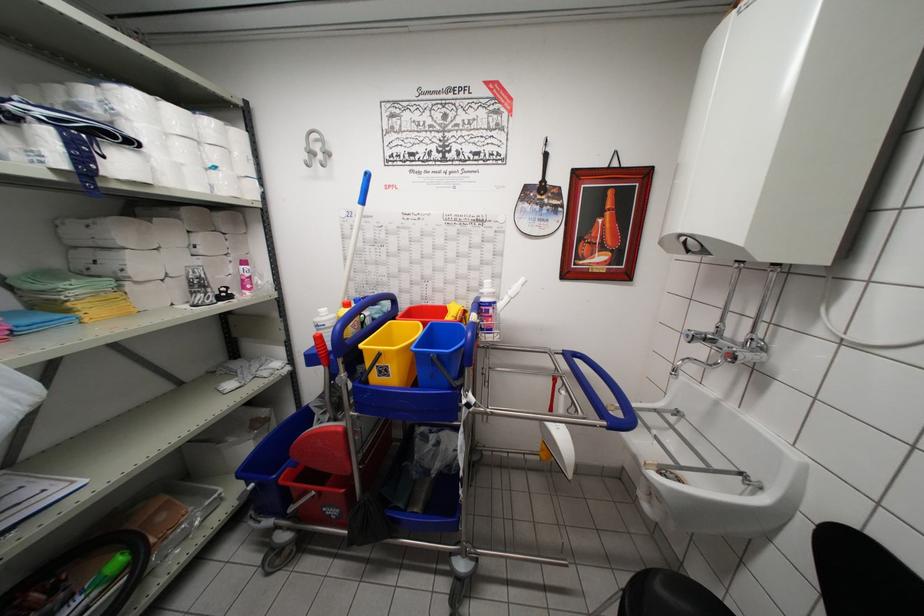
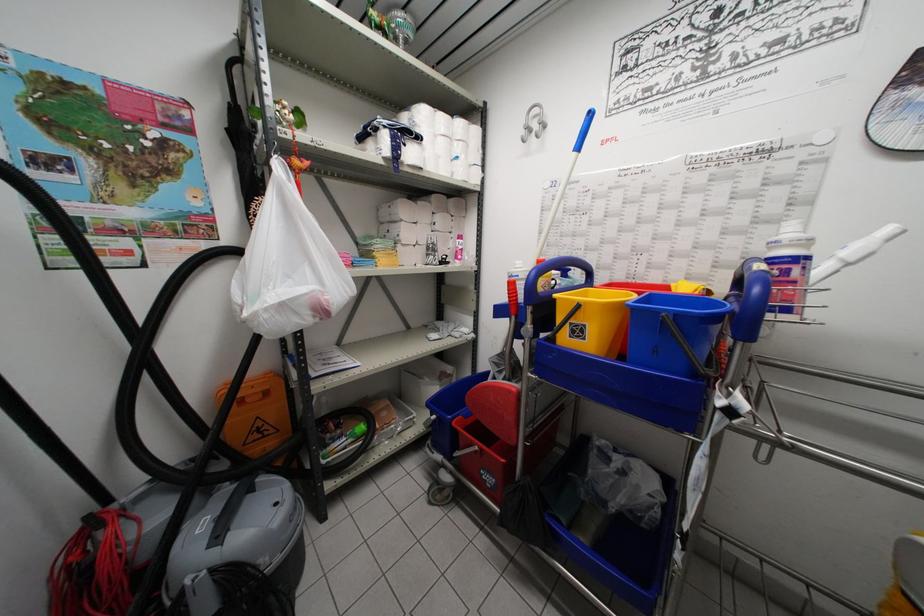
Question: The first image is from the beginning of the video and the second image is from the end. How did the camera likely rotate when shooting the video?

Choices:
 (A) Left
 (B) Right
 (C) Up
 (D) Down

Answer: (A)